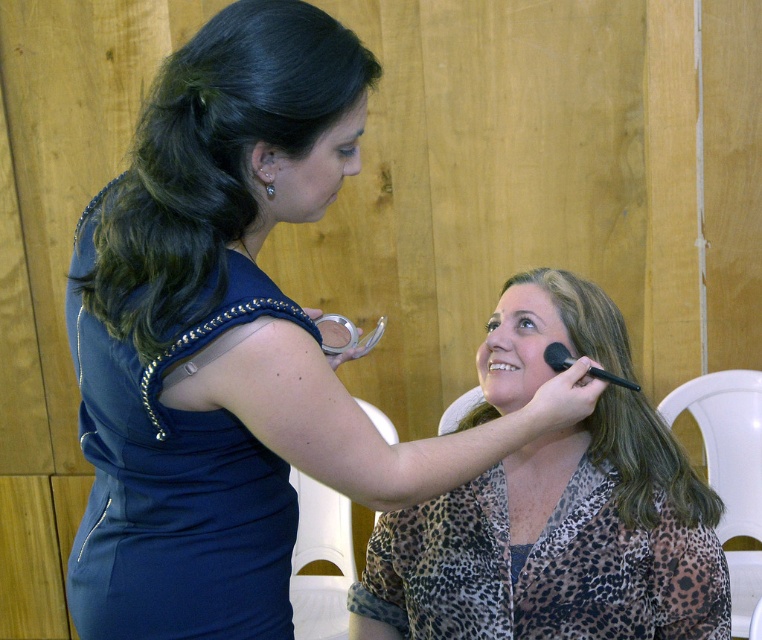
You are a photographer setting up for a photoshoot and need to place a light stand at the exact center of the image. The white plastic chair at lower right is located at coordinates 0.875, 0.421. Can you determine if the chair is positioned to the right or left of the center point?

The white plastic chair at lower right is located at coordinates (319, 560). Since the x coordinate 0.875 is greater than 0.5, the chair is positioned to the right of the center point.

You are a photographer setting up for a photoshoot. You need to position a light source to illuminate the pearl earrings at upper left without casting shadows from the white plastic chair at right. Where should you place the light relative to the chair?

The pearl earrings at upper left is behind the white plastic chair at right, so placing the light source behind the chair and facing towards the earrings would ensure the light reaches them without the chair casting a shadow.

You are a photographer setting up for a photoshoot. You have a white plastic chair at lower right and pearl earrings at upper left in your frame. Which object is closer to the camera?

The white plastic chair at lower right is closer to the camera because the pearl earrings at upper left is behind it.